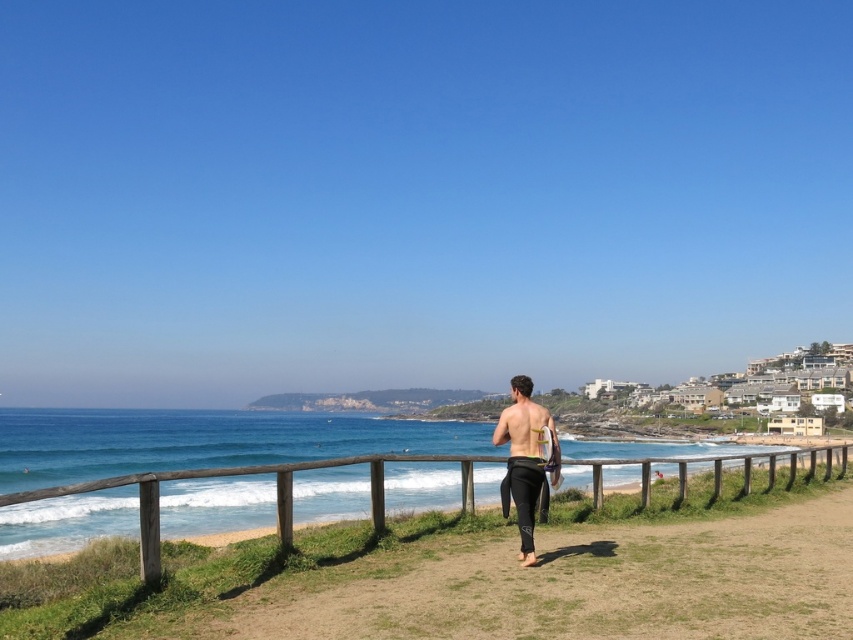
Does wooden at center appear on the right side of black wetsuit at center?

Correct, you'll find wooden at center to the right of black wetsuit at center.

Who is lower down, wooden at center or black wetsuit at center?

wooden at center is lower down.

Is point (154, 502) positioned in front of point (512, 390)?

Yes, point (154, 502) is closer to viewer.

Identify the location of wooden at center. This screenshot has width=853, height=640. (253, 474).